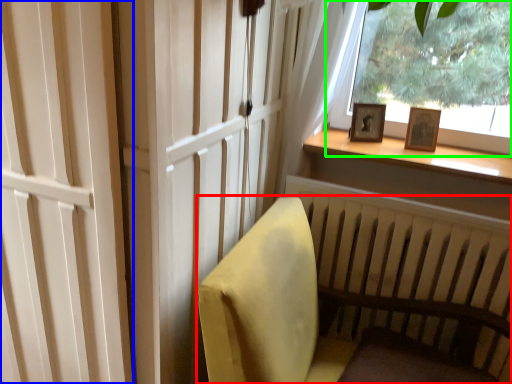
Question: Estimate the real-world distances between objects in this image. Which object is closer to furniture (highlighted by a red box), screen door (highlighted by a blue box) or window (highlighted by a green box)?

Choices:
 (A) screen door
 (B) window

Answer: (A)